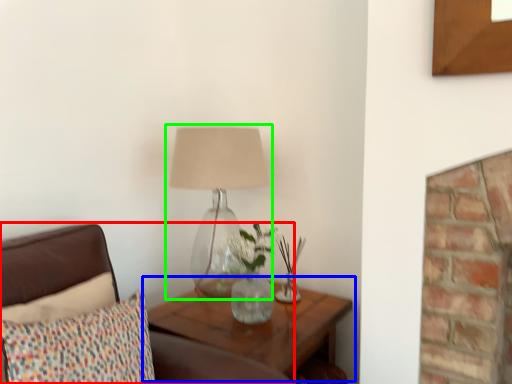
Question: Which is nearer to the furniture (highlighted by a red box)? table (highlighted by a blue box) or lamp (highlighted by a green box).

Choices:
 (A) table
 (B) lamp

Answer: (A)